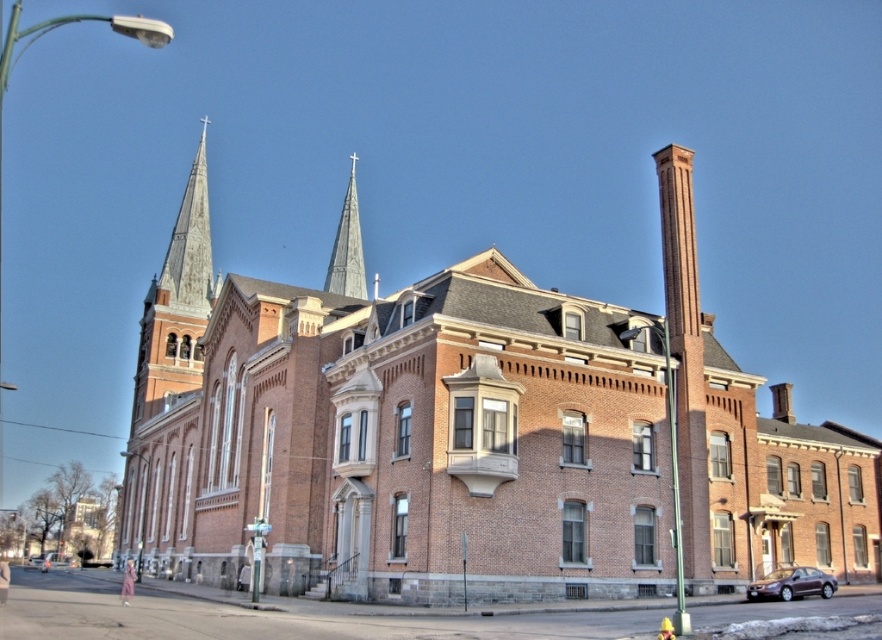
You are standing at a point 150.88 meters away from the point marked as point (199, 161). The building has two spires on its left side. Can you see both spires from your current position?

Since you are 150.88 meters away from point (199, 161), and the two spires are on the left side of the building, their positions relative to the building mean they should be visible from your current vantage point unless obstructed by the building itself. However, without additional information about the building structure or terrain, it is assumed that the spires are visible as they are typically designed to be prominent features.

You are an architect assessing the structural integrity of the building. You need to determine which of the two vertical structures, the rusty metal spire at upper left or the smooth gray steeple at center, is wider at their bases to recommend reinforcement. Based on the image, which one requires more immediate attention due to its greater width?

The rusty metal spire at upper left is wider than the smooth gray steeple at center, so it requires more immediate attention for reinforcement.